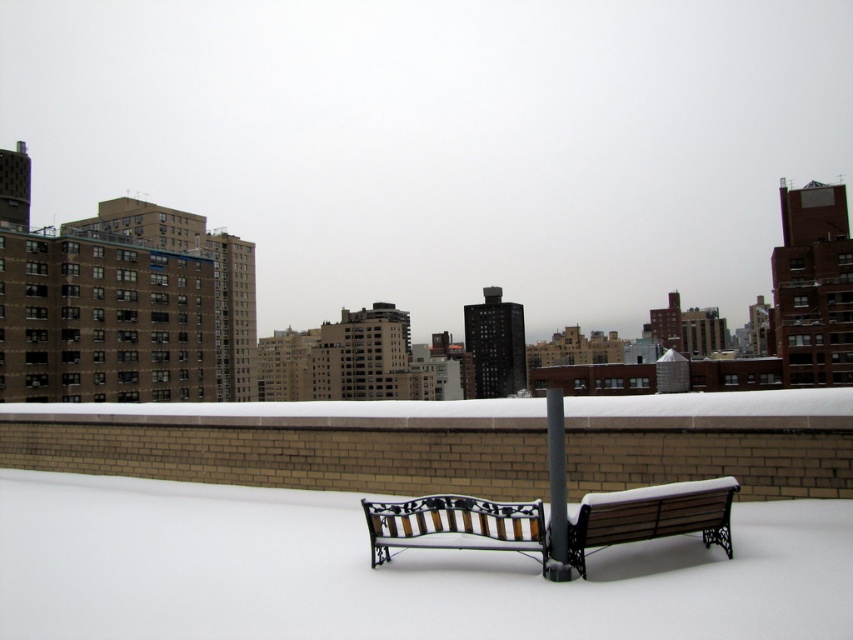
Who is more forward, (106,506) or (553,436)?

Point (553,436)

Is white fluffy snow at center positioned at the back of black metal pole at center?

No.

This screenshot has height=640, width=853. What are the coordinates of `white fluffy snow at center` in the screenshot? It's located at (386, 572).

Locate an element on the screen. The height and width of the screenshot is (640, 853). white fluffy snow at center is located at coordinates (386, 572).

Is wooden bench at center below black metal pole at center?

A: Yes.

From the picture: Between wooden bench at center and black metal pole at center, which one appears on the right side from the viewer's perspective?

From the viewer's perspective, wooden bench at center appears more on the right side.

This screenshot has height=640, width=853. I want to click on wooden bench at center, so (653, 515).

Based on the photo, does white fluffy snow at center have a greater width compared to wooden-patterned bench at center?

Incorrect, white fluffy snow at center's width does not surpass wooden-patterned bench at center's.

Based on the photo, is white fluffy snow at center smaller than wooden-patterned bench at center?

Yes.

Identify the location of white fluffy snow at center. (386, 572).

This screenshot has height=640, width=853. I want to click on white fluffy snow at center, so [386, 572].